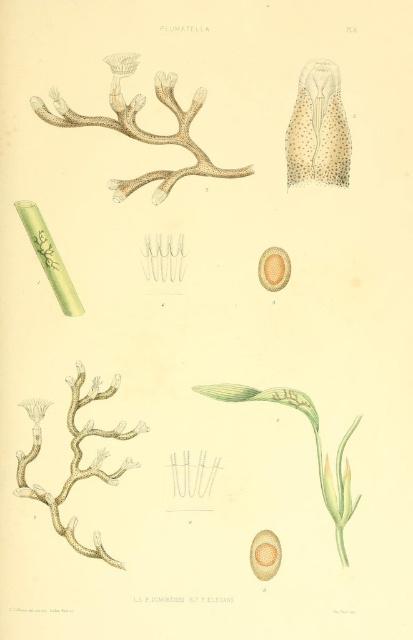
Question: Does translucent white coral at upper left appear on the right side of green leafy stem at center?

Choices:
 (A) yes
 (B) no

Answer: (B)

Question: Which point is farther to the camera?

Choices:
 (A) (156, 202)
 (B) (80, 406)
 (C) (322, 113)

Answer: (A)

Question: Which of these objects is positioned farthest from the translucent white coral at center?

Choices:
 (A) green leafy stem at center
 (B) spotted beige coral at upper right
 (C) translucent white coral at upper left

Answer: (B)

Question: Which of the following is the closest to the observer?

Choices:
 (A) (284, 145)
 (B) (339, 518)
 (C) (78, 460)

Answer: (C)

Question: Can you confirm if translucent white coral at center is wider than green leafy stem at center?

Choices:
 (A) yes
 (B) no

Answer: (B)

Question: Can you confirm if translucent white coral at upper left is smaller than green leafy stem at center?

Choices:
 (A) no
 (B) yes

Answer: (A)